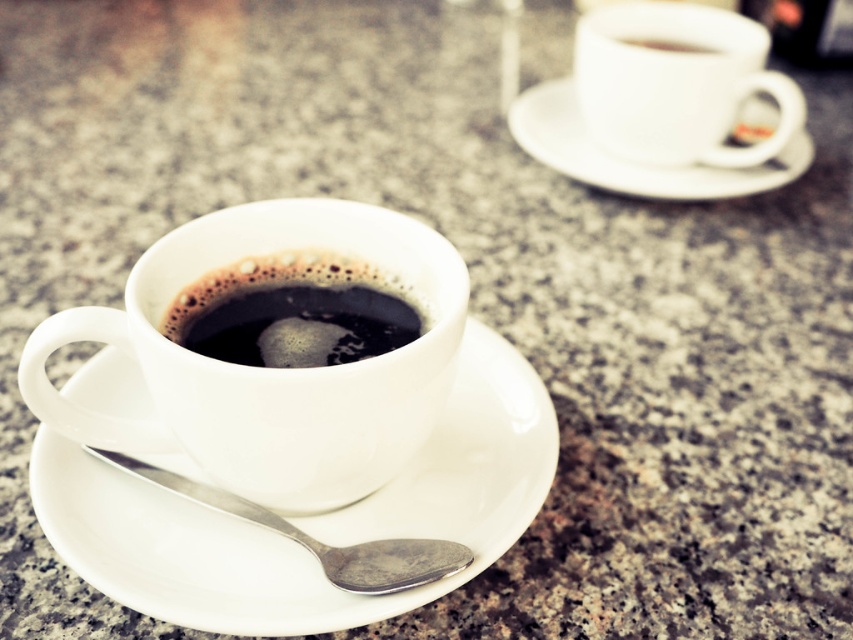
You are standing in front of the granite countertop with two cups. You want to pick up the cup that is closer to you. Which point should you reach out to, point A at coordinates point (320, 304) or point B at coordinates point (746, 134)?

Point A at coordinates point (320, 304) is in front of point B at coordinates point (746, 134), so you should reach out to point A at coordinates point (320, 304) to pick up the closer cup.